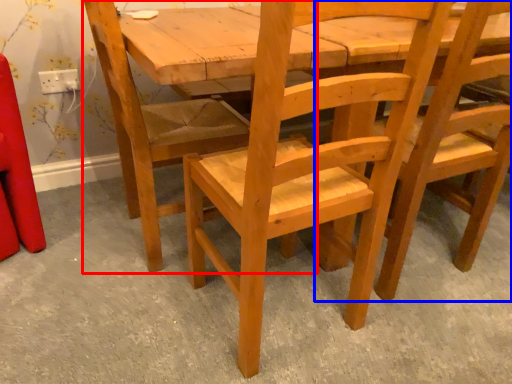
Question: Which of the following is the farthest to the observer, chair (highlighted by a red box) or chair (highlighted by a blue box)?

Choices:
 (A) chair
 (B) chair

Answer: (A)